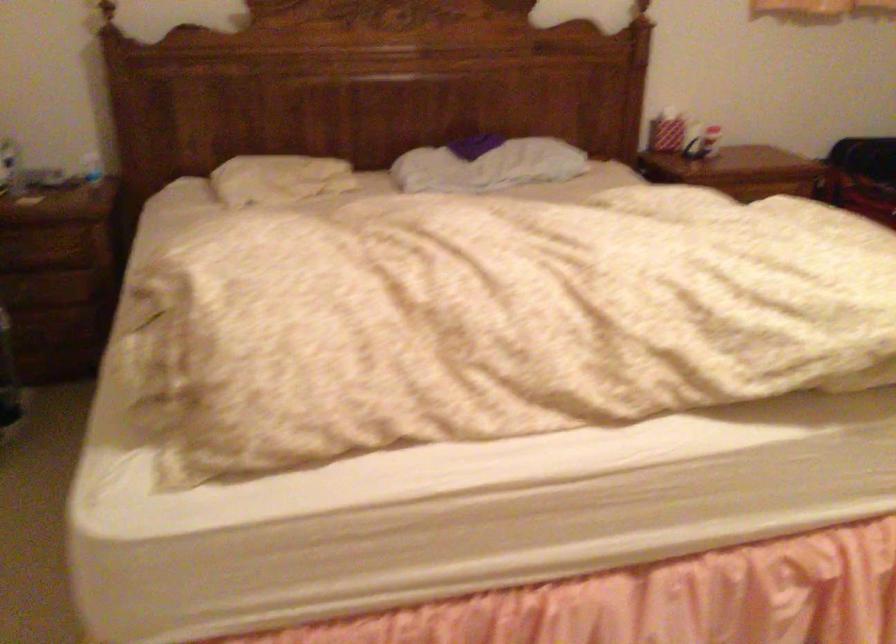
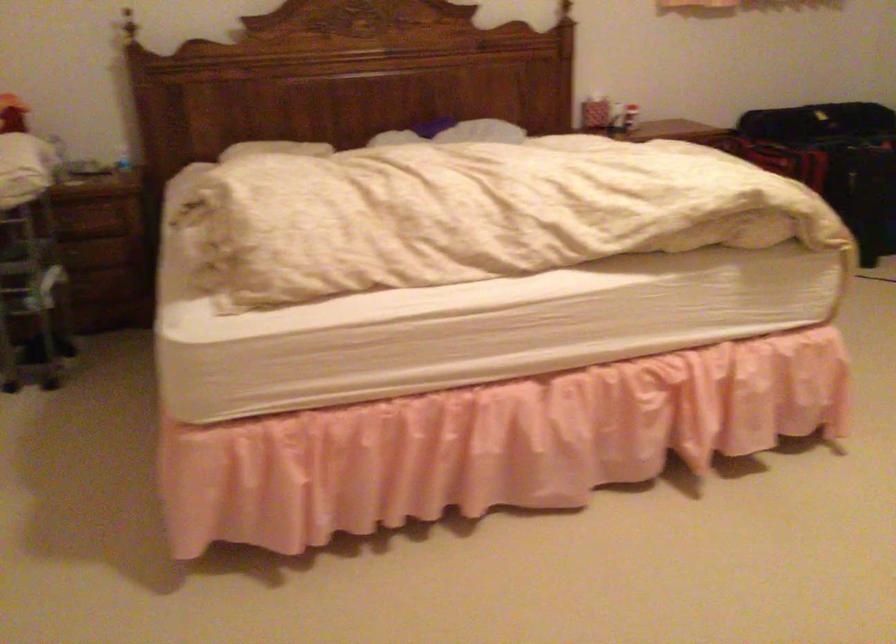
Question: Which direction would the cameraman need to move to produce the second image? Reply with the corresponding letter.

Choices:
 (A) Left
 (B) Right
 (C) Forward
 (D) Backward

Answer: (D)